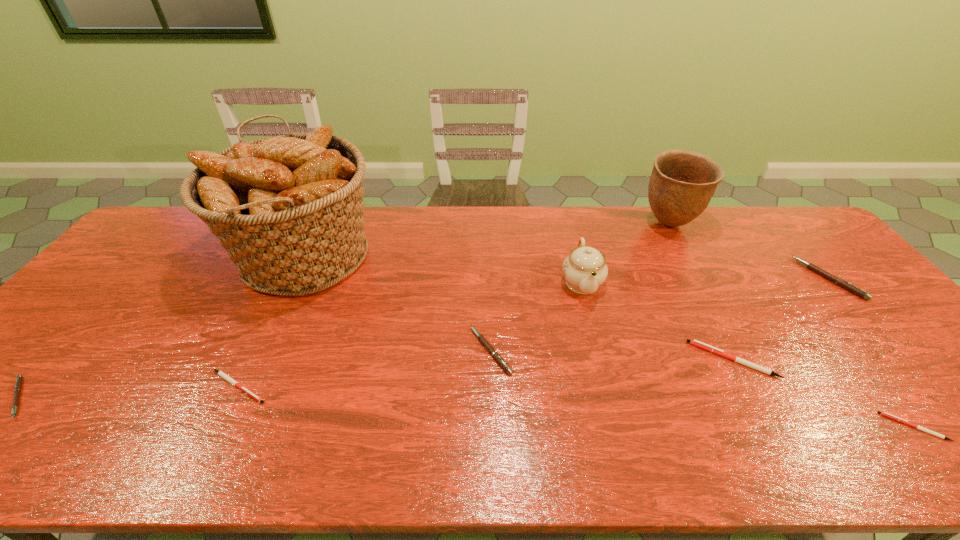
Find the location of a particular element. This screenshot has height=540, width=960. free location located 0.240m at the nib of the second biggest pink pen is located at coordinates (374, 350).

At what (x,y) coordinates should I click in order to perform the action: click on vacant space located at the nib of the second biggest pink pen. Please return your answer as a coordinate pair (x, y). The image size is (960, 540). Looking at the image, I should click on (319, 350).

Image resolution: width=960 pixels, height=540 pixels. Identify the location of vacant space located at the nib of the second biggest pink pen. (371, 350).

Locate an element on the screen. The width and height of the screenshot is (960, 540). vacant area situated 0.090m on the clicker of the biggest white pen is located at coordinates (657, 360).

Find the location of a particular element. Image resolution: width=960 pixels, height=540 pixels. free space located 0.160m on the clicker of the biggest white pen is located at coordinates (628, 360).

Locate an element on the screen. free region located on the clicker of the biggest white pen is located at coordinates (669, 360).

Find the location of `vacant space located 0.310m on the clicker of the second pen from left to right`. vacant space located 0.310m on the clicker of the second pen from left to right is located at coordinates (404, 387).

You are a GUI agent. You are given a task and a screenshot of the screen. Output one action in this format:
    pyautogui.click(x=<x>, y=<y>)
    Task: Click on the free spot located 0.120m on the clicker of the rightmost white pen
    
    Given the screenshot: What is the action you would take?
    pyautogui.click(x=831, y=427)

Locate an element on the screen. This screenshot has width=960, height=540. vacant area situated on the clicker of the rightmost white pen is located at coordinates (730, 427).

Where is `free space located 0.200m on the clicker of the rightmost white pen`? free space located 0.200m on the clicker of the rightmost white pen is located at coordinates (794, 427).